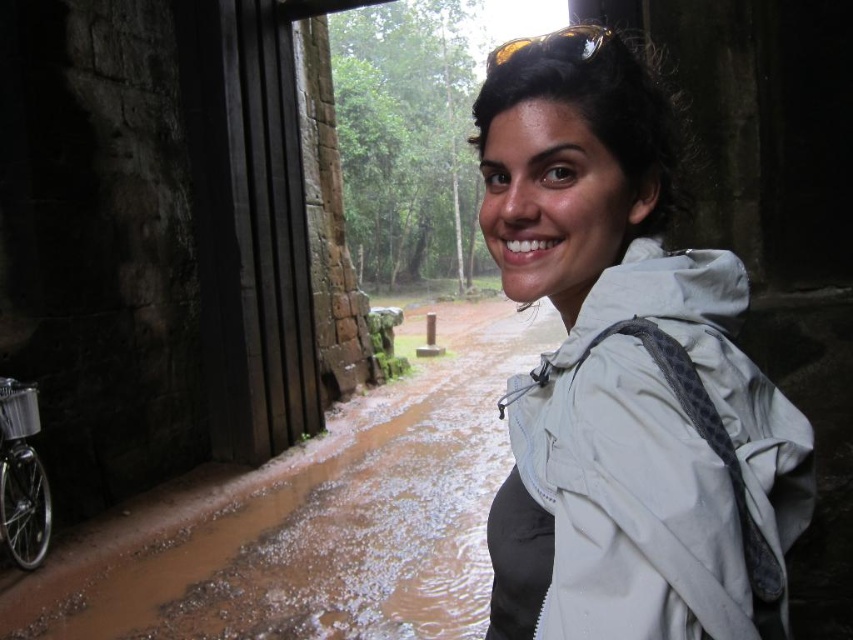
Is white matte jacket at center below brown wet mud at lower left?

Incorrect, white matte jacket at center is not positioned below brown wet mud at lower left.

Who is more forward, (679, 266) or (473, 572)?

Point (679, 266)

Who is more forward, (686,346) or (357,598)?

Positioned in front is point (686,346).

At what (x,y) coordinates should I click in order to perform the action: click on white matte jacket at center. Please return your answer as a coordinate pair (x, y). The image size is (853, 640). Looking at the image, I should click on (625, 372).